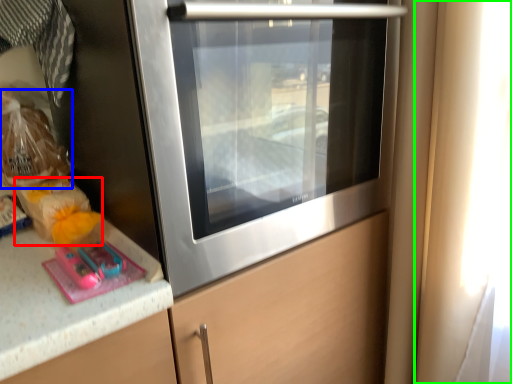
Question: Which object is positioned closest to food (highlighted by a red box)? Select from food (highlighted by a blue box) and window (highlighted by a green box).

Choices:
 (A) food
 (B) window

Answer: (A)